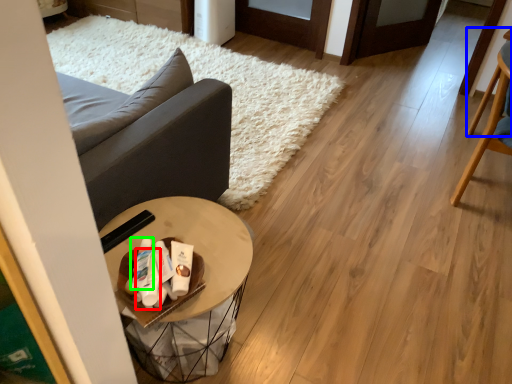
Question: Estimate the real-world distances between objects in this image. Which object is farther from toiletry (highlighted by a red box), chair (highlighted by a blue box) or toiletry (highlighted by a green box)?

Choices:
 (A) chair
 (B) toiletry

Answer: (A)